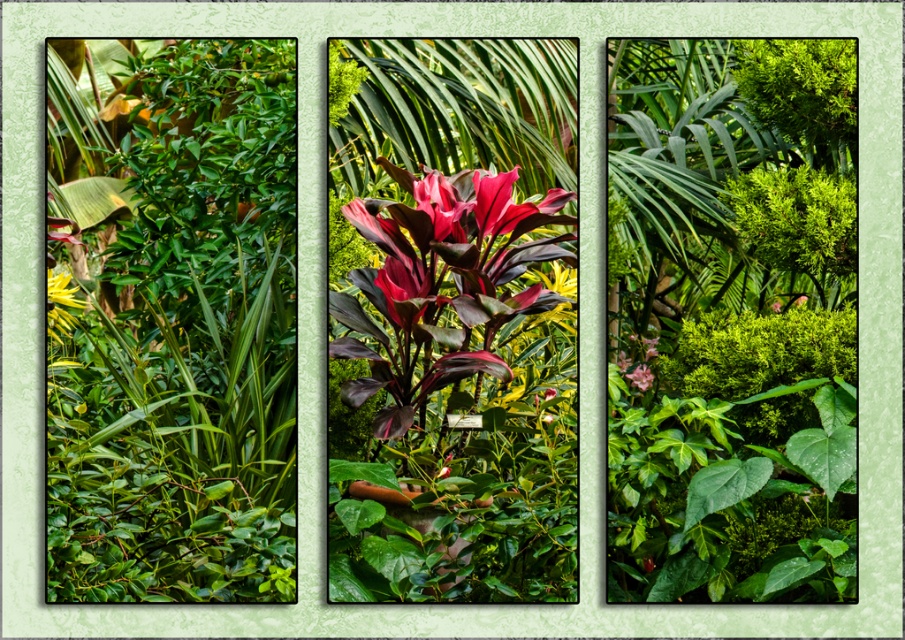
Question: Considering the real-world distances, which object is closest to the shiny crimson petals at center?

Choices:
 (A) green matte leafy bush at left
 (B) pink matte flower at center
 (C) green glossy flower at lower left
 (D) green leafy bush at center

Answer: (A)

Question: Is green leafy bush at center below shiny crimson petals at center?

Choices:
 (A) yes
 (B) no

Answer: (A)

Question: Which of the following is the closest to the observer?

Choices:
 (A) green glossy flower at lower left
 (B) green matte leafy bush at left
 (C) shiny crimson petals at center
 (D) green leafy bush at center

Answer: (D)

Question: Is shiny crimson petals at center thinner than pink matte flower at center?

Choices:
 (A) no
 (B) yes

Answer: (A)

Question: Can you confirm if shiny crimson petals at center is wider than green glossy flower at lower left?

Choices:
 (A) yes
 (B) no

Answer: (B)

Question: Which of the following is the farthest from the observer?

Choices:
 (A) (634, 374)
 (B) (675, 385)

Answer: (A)